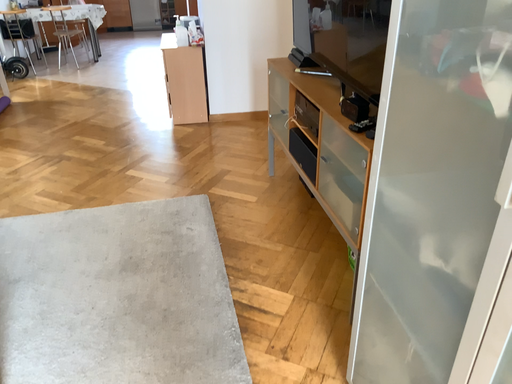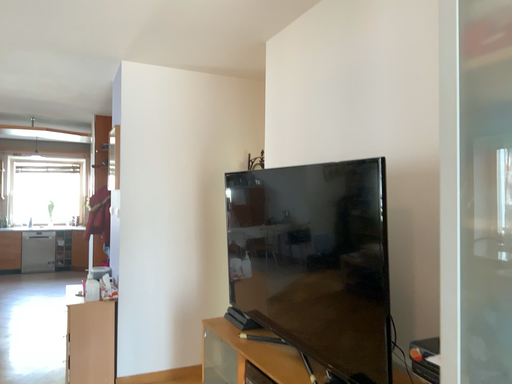
Question: Which way did the camera rotate in the video?

Choices:
 (A) rotated upward
 (B) rotated downward

Answer: (A)